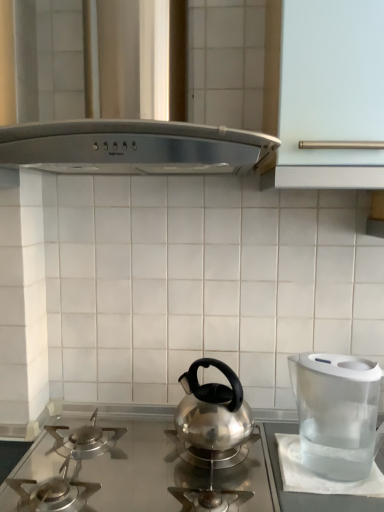
Question: Could you tell me if satin silver gas stove at center is turned towards satin silver vent at upper center?

Choices:
 (A) no
 (B) yes

Answer: (A)

Question: Can you confirm if satin silver gas stove at center is positioned to the left of satin silver vent at upper center?

Choices:
 (A) no
 (B) yes

Answer: (A)

Question: Considering the relative sizes of satin silver gas stove at center and satin silver vent at upper center in the image provided, is satin silver gas stove at center thinner than satin silver vent at upper center?

Choices:
 (A) yes
 (B) no

Answer: (A)

Question: Considering the relative positions of satin silver gas stove at center and satin silver vent at upper center in the image provided, is satin silver gas stove at center behind satin silver vent at upper center?

Choices:
 (A) no
 (B) yes

Answer: (B)

Question: Is satin silver gas stove at center looking in the opposite direction of satin silver vent at upper center?

Choices:
 (A) no
 (B) yes

Answer: (A)

Question: Would you say satin silver gas stove at center is to the left or to the right of transparent plastic water filter at right in the picture?

Choices:
 (A) right
 (B) left

Answer: (B)

Question: From a real-world perspective, relative to transparent plastic water filter at right, is satin silver gas stove at center vertically above or below?

Choices:
 (A) above
 (B) below

Answer: (B)

Question: In the image, is satin silver gas stove at center positioned in front of or behind transparent plastic water filter at right?

Choices:
 (A) front
 (B) behind

Answer: (A)

Question: Considering the positions of point (246, 465) and point (312, 378), is point (246, 465) closer or farther from the camera than point (312, 378)?

Choices:
 (A) farther
 (B) closer

Answer: (A)

Question: From the image's perspective, is satin silver gas stove at center located above or below satin silver vent at upper center?

Choices:
 (A) above
 (B) below

Answer: (B)

Question: Is satin silver gas stove at center taller or shorter than satin silver vent at upper center?

Choices:
 (A) short
 (B) tall

Answer: (A)

Question: From a real-world perspective, relative to satin silver vent at upper center, is satin silver gas stove at center vertically above or below?

Choices:
 (A) below
 (B) above

Answer: (A)

Question: Considering the positions of satin silver gas stove at center and satin silver vent at upper center in the image, is satin silver gas stove at center bigger or smaller than satin silver vent at upper center?

Choices:
 (A) small
 (B) big

Answer: (A)

Question: In terms of width, does satin silver vent at upper center look wider or thinner when compared to transparent plastic water filter at right?

Choices:
 (A) wide
 (B) thin

Answer: (A)

Question: Considering the positions of point (233, 18) and point (299, 424), is point (233, 18) closer or farther from the camera than point (299, 424)?

Choices:
 (A) closer
 (B) farther

Answer: (A)